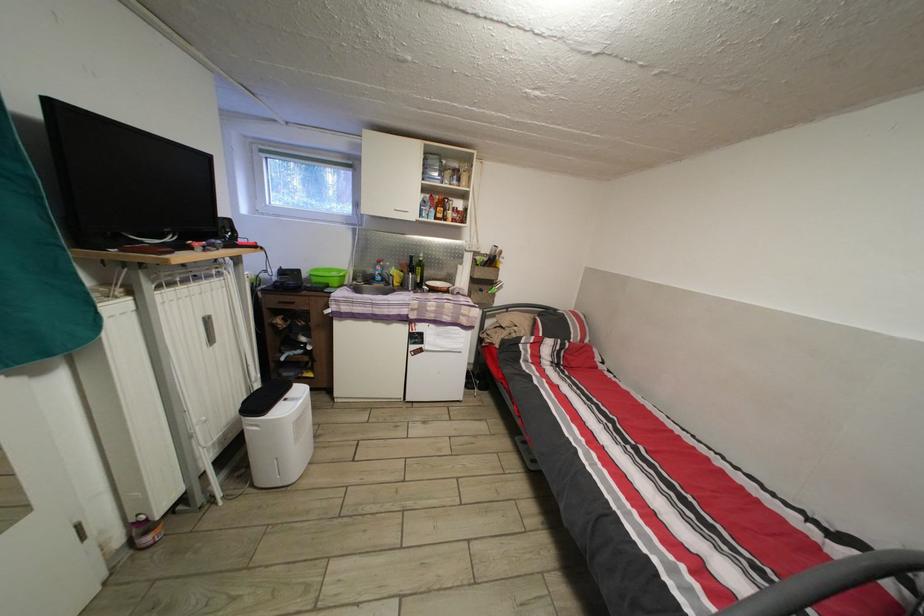
Where would you pull the white window handle? Please return your answer as a coordinate pair (x, y).

(302, 185)